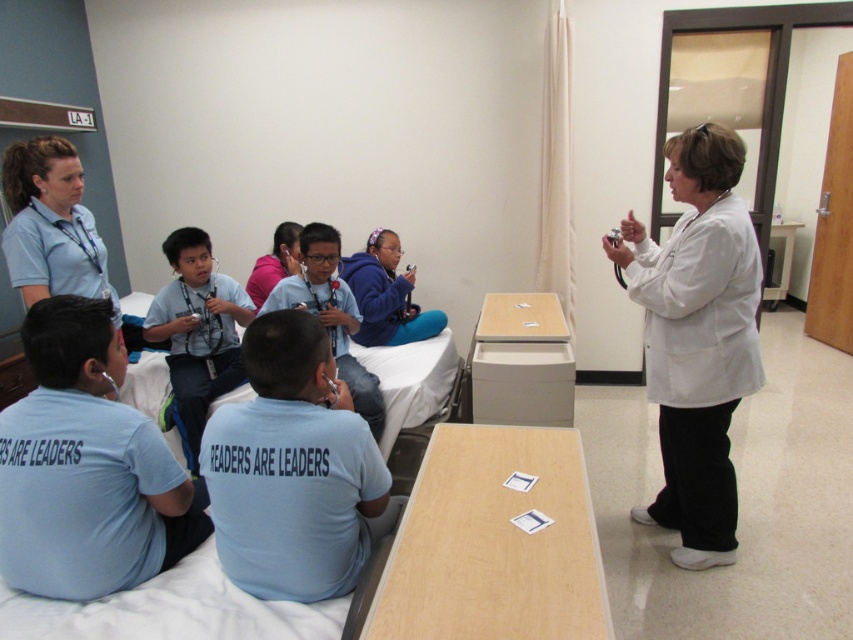
Question: Is light blue cotton shirt at center to the right of matte purple hoodie at center from the viewer's perspective?

Choices:
 (A) no
 (B) yes

Answer: (A)

Question: Does light blue cotton shirt at lower left have a greater width compared to matte white coat at center?

Choices:
 (A) yes
 (B) no

Answer: (B)

Question: Is light blue cotton shirt at lower left smaller than matte purple hoodie at center?

Choices:
 (A) yes
 (B) no

Answer: (A)

Question: Which point is closer to the camera?

Choices:
 (A) (289, 280)
 (B) (408, 285)
 (C) (270, 266)

Answer: (A)

Question: Which of the following is the closest to the observer?

Choices:
 (A) (708, 307)
 (B) (308, 534)
 (C) (289, 272)

Answer: (B)

Question: Among these objects, which one is farthest from the camera?

Choices:
 (A) matte purple hoodie at center
 (B) light blue cotton shirt at lower left
 (C) white matte coat at right
 (D) matte white coat at center

Answer: (A)